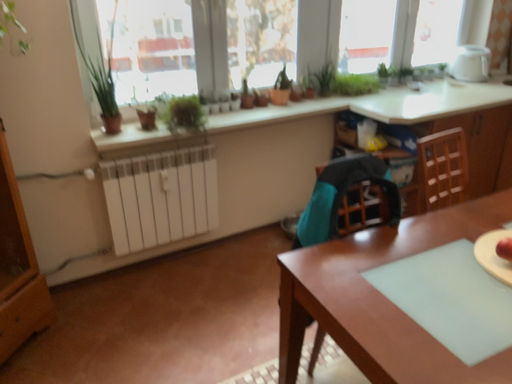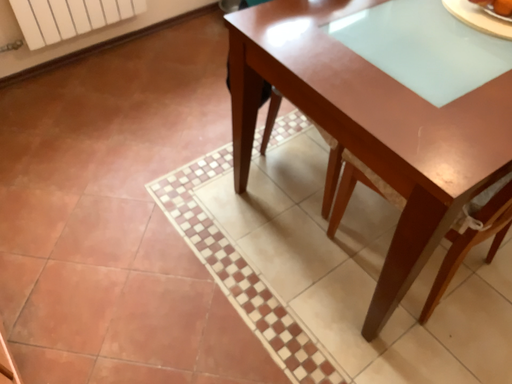
Question: How did the camera likely rotate when shooting the video?

Choices:
 (A) rotated upward
 (B) rotated downward

Answer: (B)